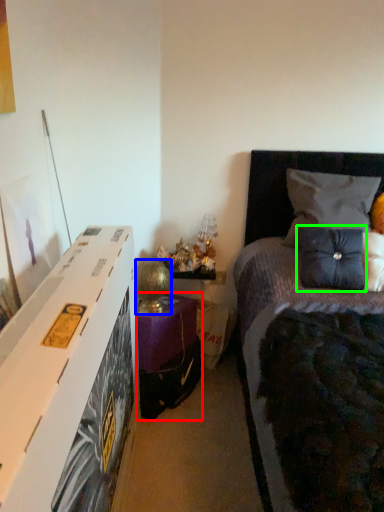
Question: Considering the real-world distances, which object is farthest from nightstand (highlighted by a red box)? table lamp (highlighted by a blue box) or pillow (highlighted by a green box)?

Choices:
 (A) table lamp
 (B) pillow

Answer: (B)